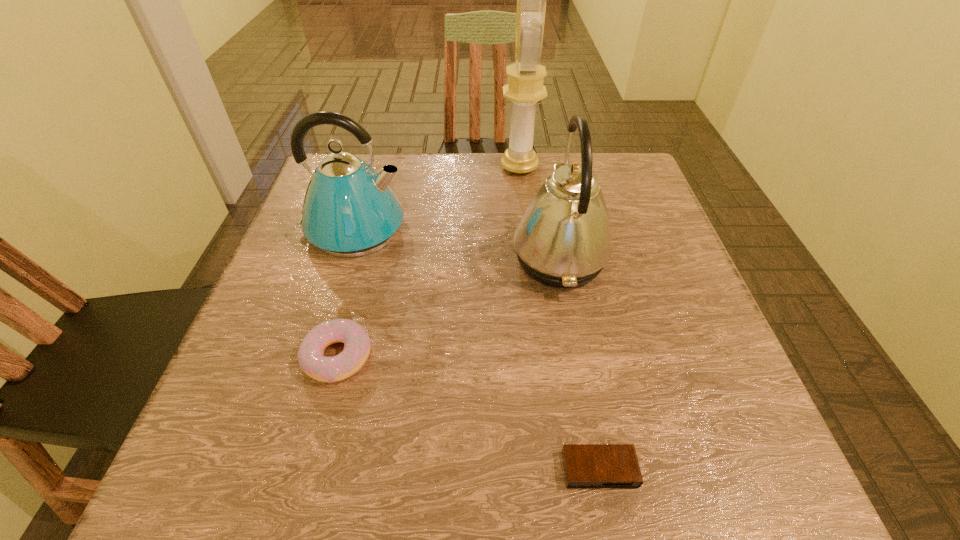
Where is `free space between the left kettle and the doughnut`? free space between the left kettle and the doughnut is located at coordinates (346, 293).

Image resolution: width=960 pixels, height=540 pixels. Identify the location of free point between the fourth tallest object and the nearest object. (468, 413).

Identify the location of unoccupied area between the alarm clock and the award. The image size is (960, 540). (560, 318).

Identify the location of blank region between the fourth farthest object and the left kettle. The height and width of the screenshot is (540, 960). (346, 293).

Locate an element on the screen. The height and width of the screenshot is (540, 960). empty space between the shortest object and the left kettle is located at coordinates (476, 349).

Select which object is the closest to the farthest object. Please provide its 2D coordinates. Your answer should be formatted as a tuple, i.e. [(x, y)], where the tuple contains the x and y coordinates of a point satisfying the conditions above.

[(563, 240)]

Identify which object is the fourth closest to the doughnut. Please provide its 2D coordinates. Your answer should be formatted as a tuple, i.e. [(x, y)], where the tuple contains the x and y coordinates of a point satisfying the conditions above.

[(525, 88)]

Identify the location of vacant area in the image that satisfies the following two spatial constraints: 1. at the spout of the second nearest object; 2. on the left side of the left kettle. (313, 356).

Locate an element on the screen. free location that satisfies the following two spatial constraints: 1. on the front-facing side of the award; 2. on the front side of the fourth tallest object is located at coordinates (540, 356).